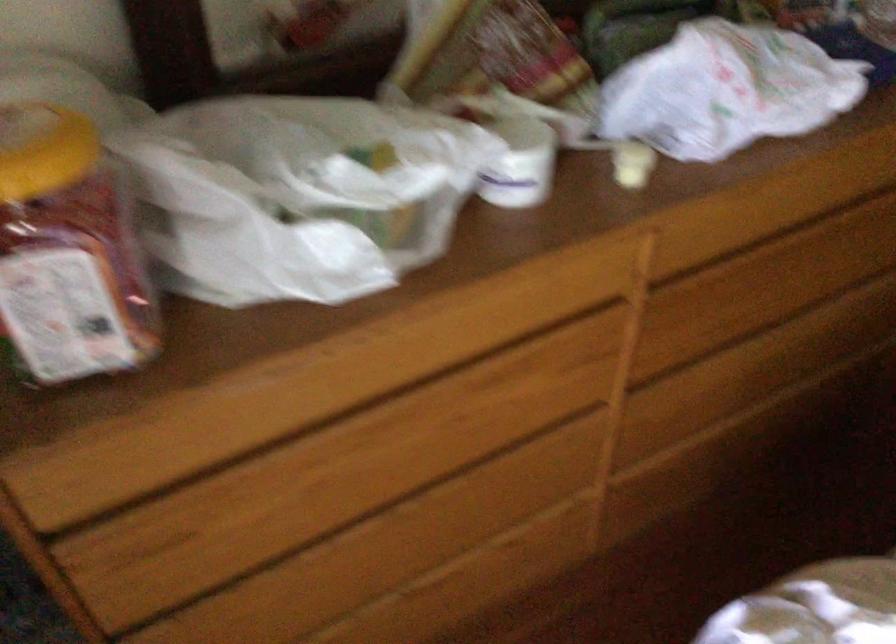
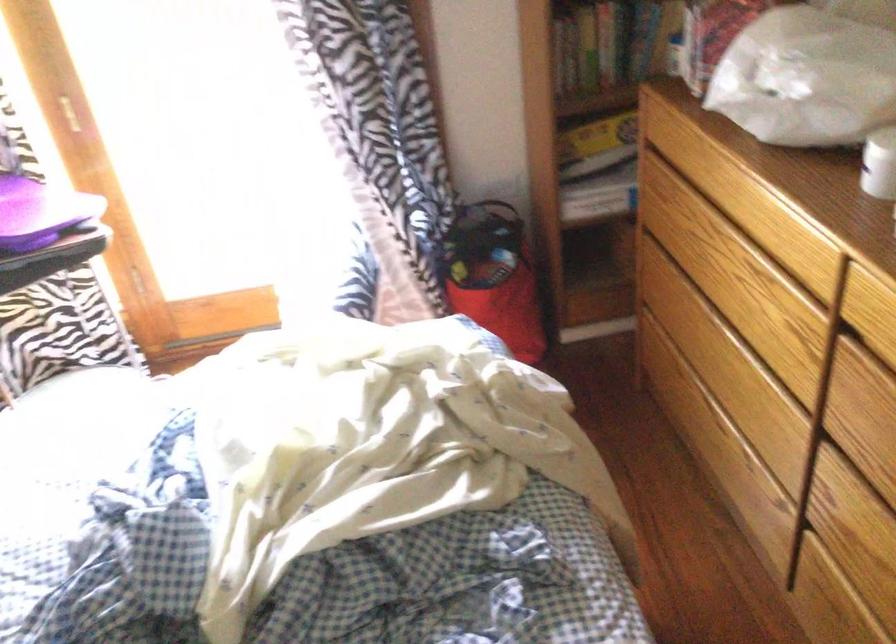
Where in the second image is the point corresponding to point 446,525 from the first image?

(719, 355)